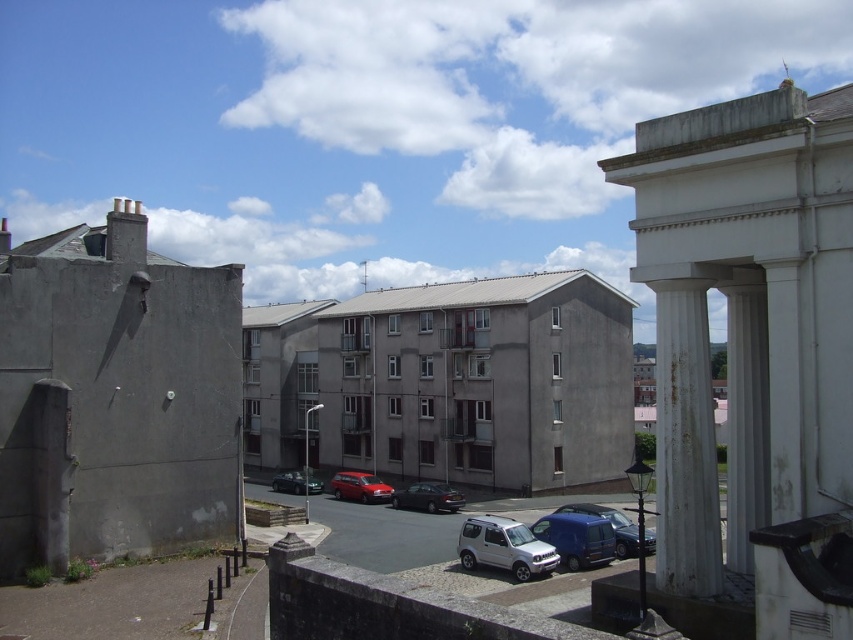
You are a delivery person trying to park your van between the silver metallic suv at center and the metallic silver sedan at center. Can you fit your van, which is 2 meters wide, between them?

The silver metallic suv at center is positioned on the right side of metallic silver sedan at center. The distance between them is not provided, so it is impossible to determine if the van can fit. Please check the actual space available.

You are standing at the point marked by the coordinates point (577, 538) in the image. Looking around, you see a matte blue van at lower center. What object are you standing on?

You are standing on the matte blue van at lower center indicated by point (577, 538).

From the picture: You are a delivery driver who needs to park your vehicle between two other cars in the image. Your vehicle is 2 meters wide. The two cars you need to park between are the matte blue van at lower center and the metallic red station wagon at center. Can your vehicle fit in the space between them?

The matte blue van at lower center has a lesser width compared to metallic red station wagon at center. Since your vehicle is 2 meters wide, you need to check the space between them. However, the exact distance between the two cars isn not provided in the description. Without knowing the distance, it is impossible to determine if your vehicle can fit.